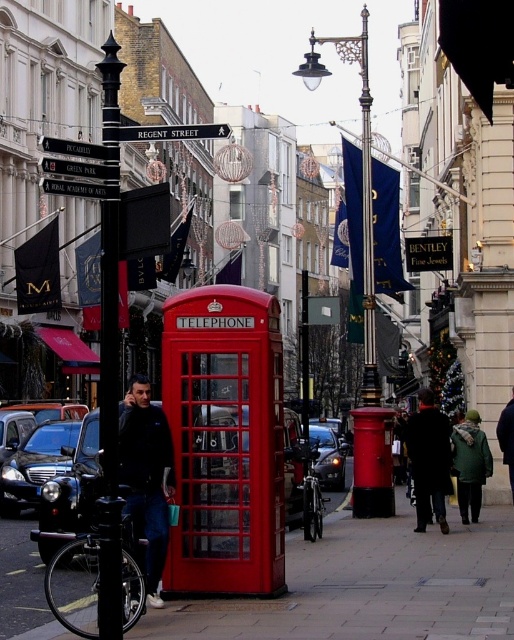
Question: Among these points, which one is nearest to the camera?

Choices:
 (A) (78, 182)
 (B) (133, 433)
 (C) (370, 172)

Answer: (A)

Question: Can you confirm if dark gray sweater at center is positioned to the right of black metal street sign at upper center?

Choices:
 (A) yes
 (B) no

Answer: (A)

Question: Is dark wool coat at center to the left of metallic gold sign at upper center from the viewer's perspective?

Choices:
 (A) yes
 (B) no

Answer: (B)

Question: Which point appears closest to the camera in this image?

Choices:
 (A) (106, 492)
 (B) (146, 460)

Answer: (A)

Question: Can you confirm if dark gray sweater at center is thinner than metallic silver street sign at upper center?

Choices:
 (A) yes
 (B) no

Answer: (A)

Question: Which object is positioned farthest from the polished brass pole at center?

Choices:
 (A) black metal pole at left
 (B) smooth concrete sidewalk at center
 (C) dark wool coat at center

Answer: (A)